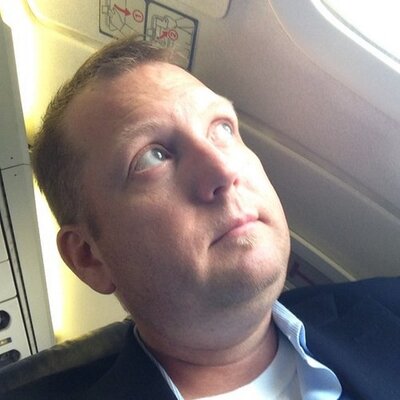
Image resolution: width=400 pixels, height=400 pixels. In order to click on airplane interior in this screenshot , I will do click(374, 227).